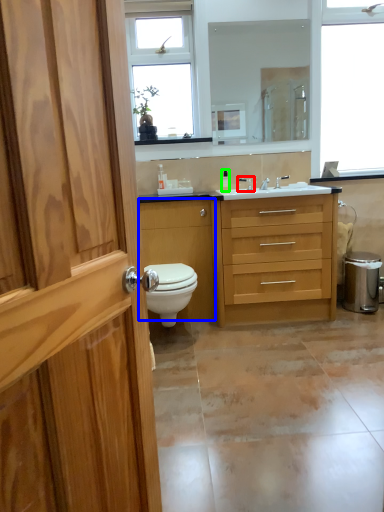
Question: Estimate the real-world distances between objects in this image. Which object is closer to tap (highlighted by a red box), cabinetry (highlighted by a blue box) or toiletry (highlighted by a green box)?

Choices:
 (A) cabinetry
 (B) toiletry

Answer: (B)